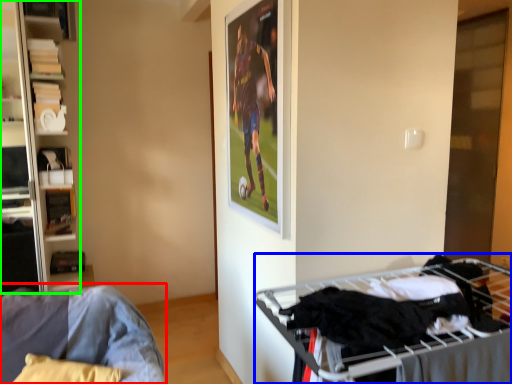
Question: Considering the real-world distances, which object is farthest from furniture (highlighted by a red box)? bunk bed (highlighted by a blue box) or shelf (highlighted by a green box)?

Choices:
 (A) bunk bed
 (B) shelf

Answer: (B)